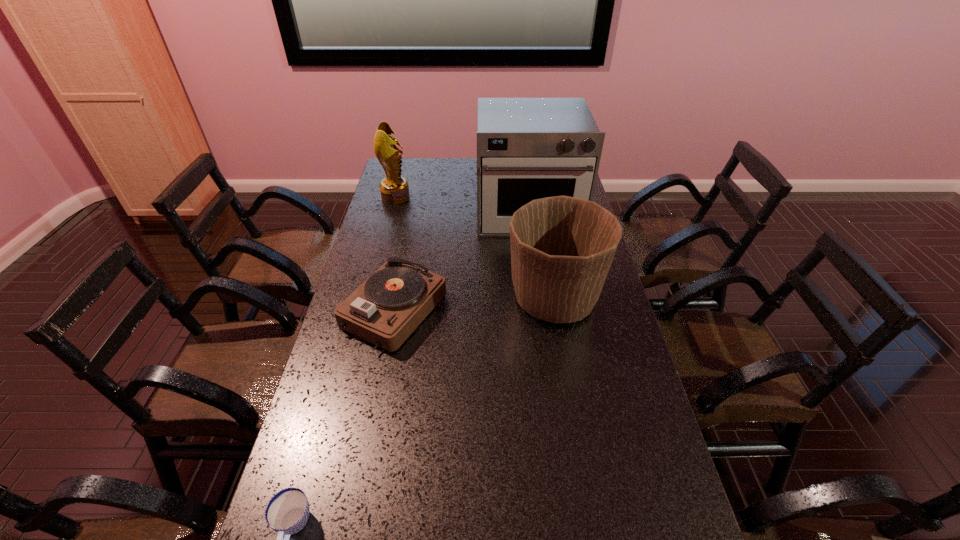
Find the location of `toaster oven that is at the right edge`. toaster oven that is at the right edge is located at coordinates (527, 148).

Identify the location of flowerpot present at the right edge. (562, 247).

The image size is (960, 540). In the image, there is a desktop. What are the coordinates of `vacant space at the far edge` in the screenshot? It's located at (468, 160).

Identify the location of vacant area at the left edge. (358, 374).

Find the location of a particular element. The image size is (960, 540). blank space at the right edge is located at coordinates (621, 416).

This screenshot has width=960, height=540. I want to click on vacant space at the far left corner of the desktop, so click(x=408, y=172).

Locate an element on the screen. Image resolution: width=960 pixels, height=540 pixels. free space between the second shortest object and the flowerpot is located at coordinates (474, 305).

Image resolution: width=960 pixels, height=540 pixels. I want to click on free point between the flowerpot and the fourth tallest object, so click(474, 305).

Where is `vacant area that lies between the record player and the flowerpot`? The image size is (960, 540). vacant area that lies between the record player and the flowerpot is located at coordinates (474, 305).

Where is `object that is the closest one to the nearest object`? object that is the closest one to the nearest object is located at coordinates (386, 308).